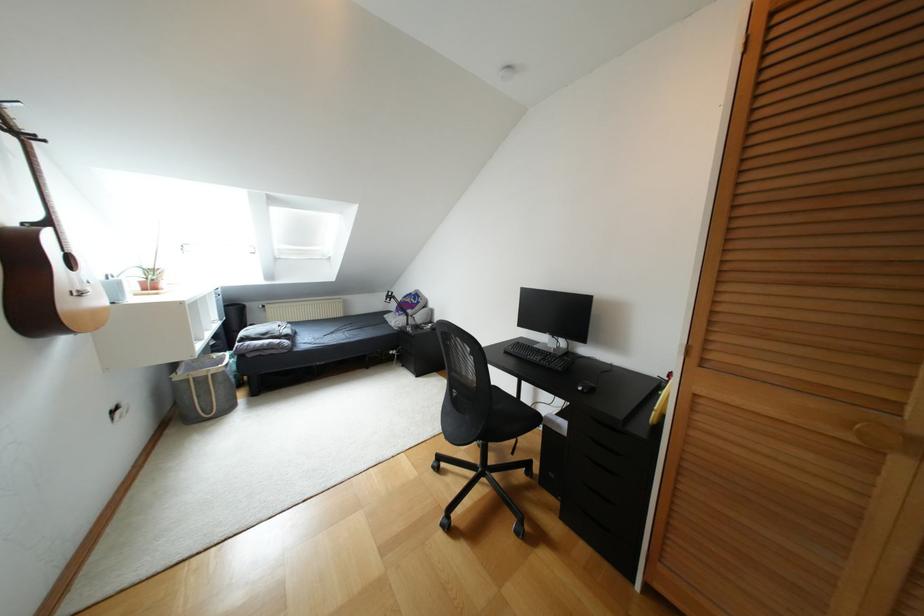
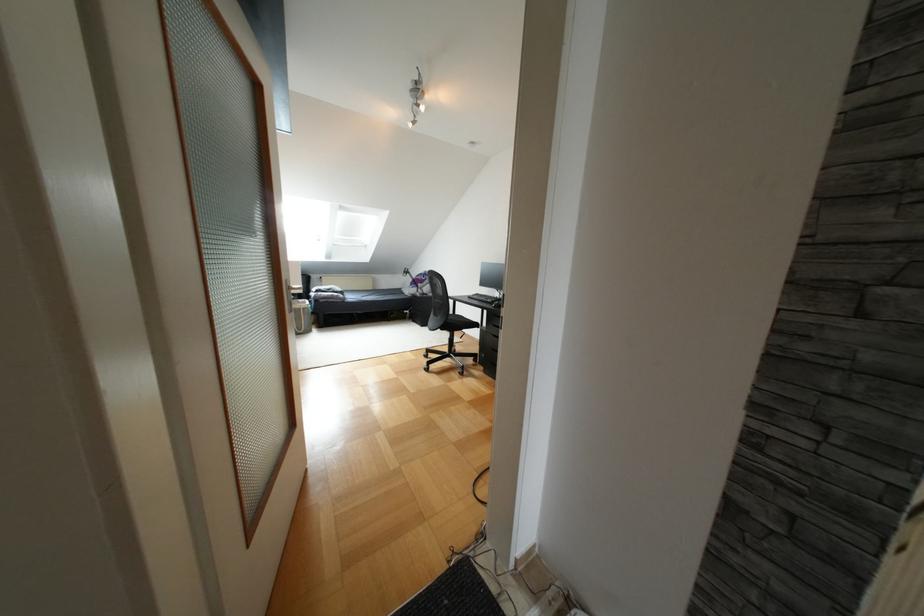
Where in the second image is the point corresponding to point 378,317 from the first image?

(396, 290)